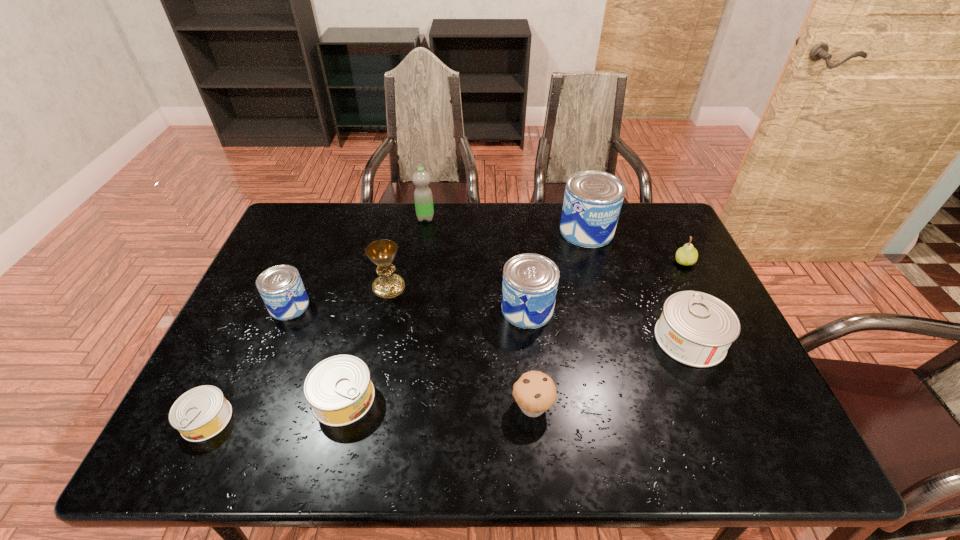
Find the location of a particular element. The height and width of the screenshot is (540, 960). free space located 0.170m on the front label of the second biggest blue can is located at coordinates (440, 309).

Identify the location of free space located on the front label of the second biggest blue can. The image size is (960, 540). (468, 309).

Where is `vacant space located on the front label of the leftmost blue can`? vacant space located on the front label of the leftmost blue can is located at coordinates (413, 306).

The width and height of the screenshot is (960, 540). I want to click on vacant area located on the back of the green pear, so click(676, 245).

You are a GUI agent. You are given a task and a screenshot of the screen. Output one action in this format:
    pyautogui.click(x=<x>, y=<y>)
    Task: Click on the blank area located 0.130m on the back of the farthest silver can
    The image size is (960, 540).
    Given the screenshot: What is the action you would take?
    pyautogui.click(x=664, y=280)

The width and height of the screenshot is (960, 540). Find the location of `vacant region located 0.290m on the right of the muffin`. vacant region located 0.290m on the right of the muffin is located at coordinates (681, 406).

The width and height of the screenshot is (960, 540). What are the coordinates of `free point located 0.090m on the right of the second shortest object` in the screenshot? It's located at (414, 399).

Identify the location of vacant position located on the back of the smallest silver can. The height and width of the screenshot is (540, 960). (250, 330).

Identify the location of water bottle present at the far edge. The width and height of the screenshot is (960, 540). (423, 198).

The image size is (960, 540). I want to click on can located at the far edge, so click(593, 199).